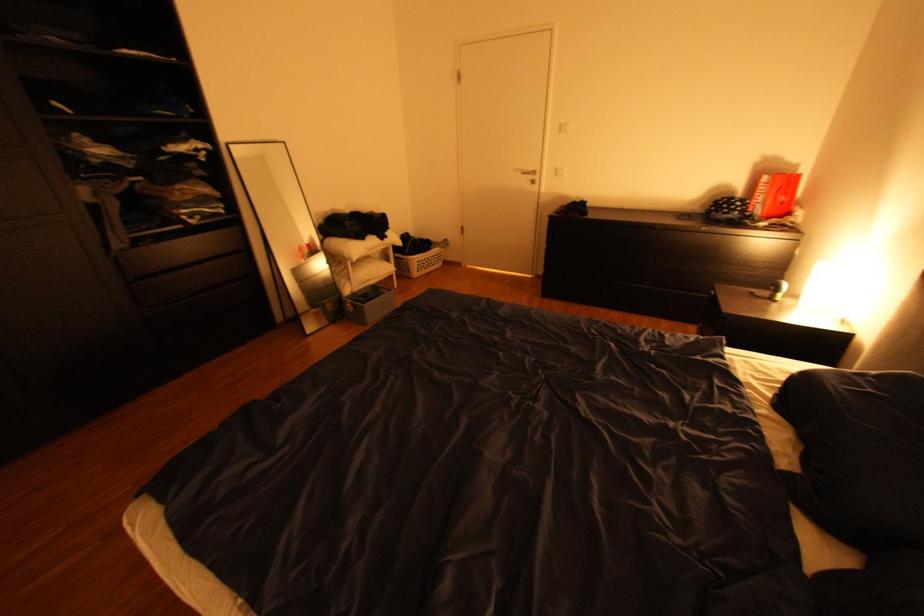
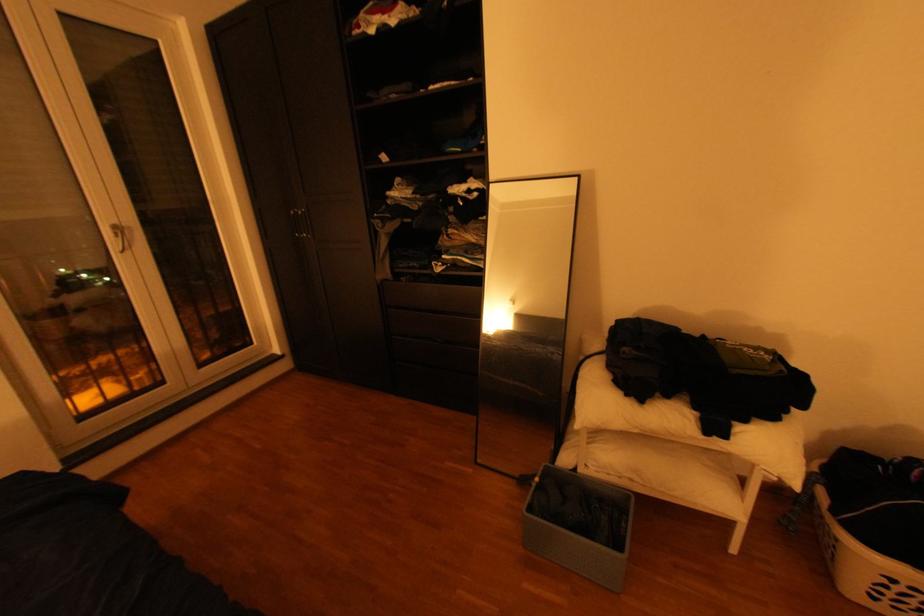
In the second image, find the point that corresponds to [395,237] in the first image.

(735, 436)